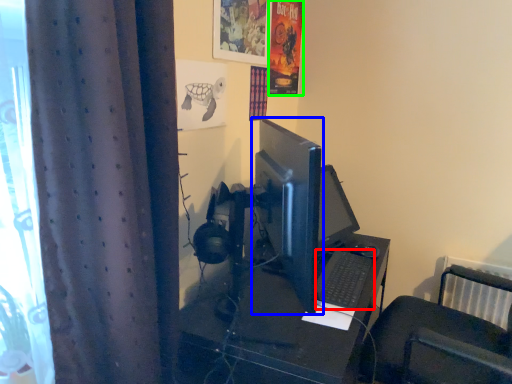
Question: Which is nearer to the computer keyboard (highlighted by a red box)? computer monitor (highlighted by a blue box) or poster page (highlighted by a green box).

Choices:
 (A) computer monitor
 (B) poster page

Answer: (A)